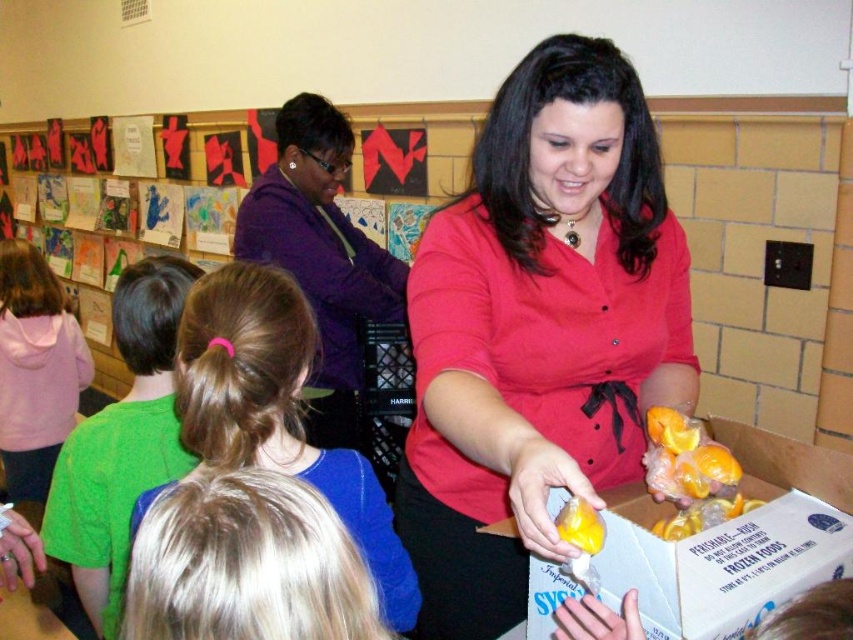
You are a photographer taking a picture of the matte red blouse at center and the yellow rubber glove at lower center. Which object should you focus on first to ensure both are in frame?

The matte red blouse at center is above the yellow rubber glove at lower center, so you should focus on the matte red blouse at center first to ensure both are in frame.

You are a person trying to reach the yellow rubber glove at lower center from the matte red blouse at center. The space between them is 18.61 inches. If your arm can extend 16 inches, can you reach the glove without moving?

The distance between the matte red blouse at center and the yellow rubber glove at lower center is 18.61 inches. Since your arm can only extend 16 inches, you cannot reach the yellow rubber glove at lower center without moving closer.

Based on the photo, you are standing in the classroom and want to move from point (76, 368) to point (701, 502). Which direction should you move to get closer to the camera?

To move closer to the camera, you should move towards point (76, 368) because it is further away from the camera compared to point (701, 502).